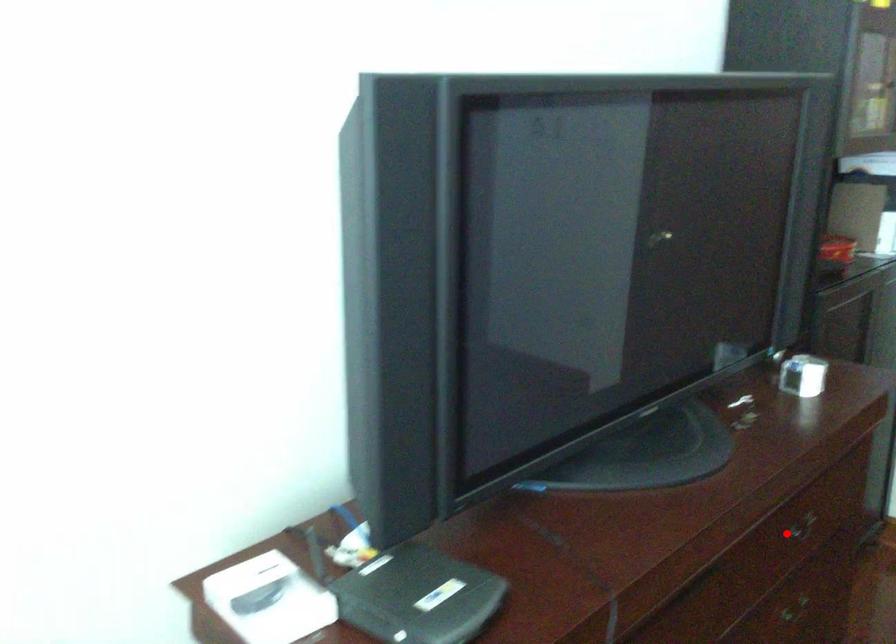
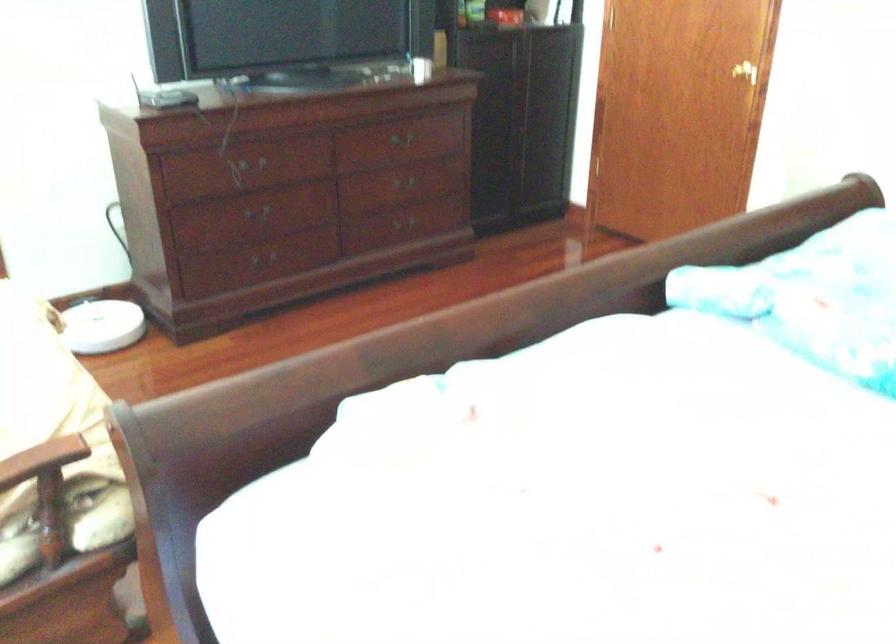
Question: I am providing you with two images of the same scene from different viewpoints. Image1 has a red point marked. In image2, the corresponding 3D location appears at what relative position? Reply with the corresponding letter.

Choices:
 (A) Closer
 (B) Farther

Answer: (B)